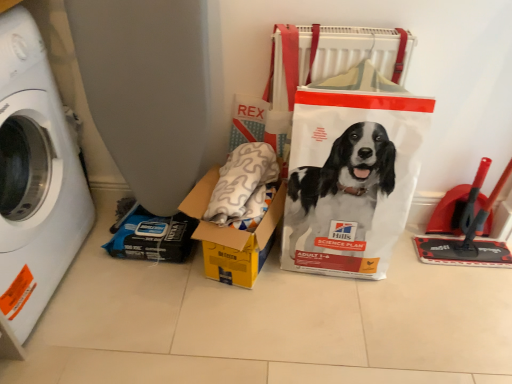
Question: Considering the relative positions of white plastic bag at center and yellow cardboard box at center in the image provided, is white plastic bag at center to the left or to the right of yellow cardboard box at center?

Choices:
 (A) right
 (B) left

Answer: (A)

Question: Is point (342, 228) closer or farther from the camera than point (221, 238)?

Choices:
 (A) closer
 (B) farther

Answer: (B)

Question: Which object is the closest to the yellow cardboard box at center?

Choices:
 (A) white plastic bag at center
 (B) white plastic washing machine at left

Answer: (A)

Question: Which of these objects is positioned farthest from the white plastic bag at center?

Choices:
 (A) white plastic washing machine at left
 (B) yellow cardboard box at center

Answer: (A)